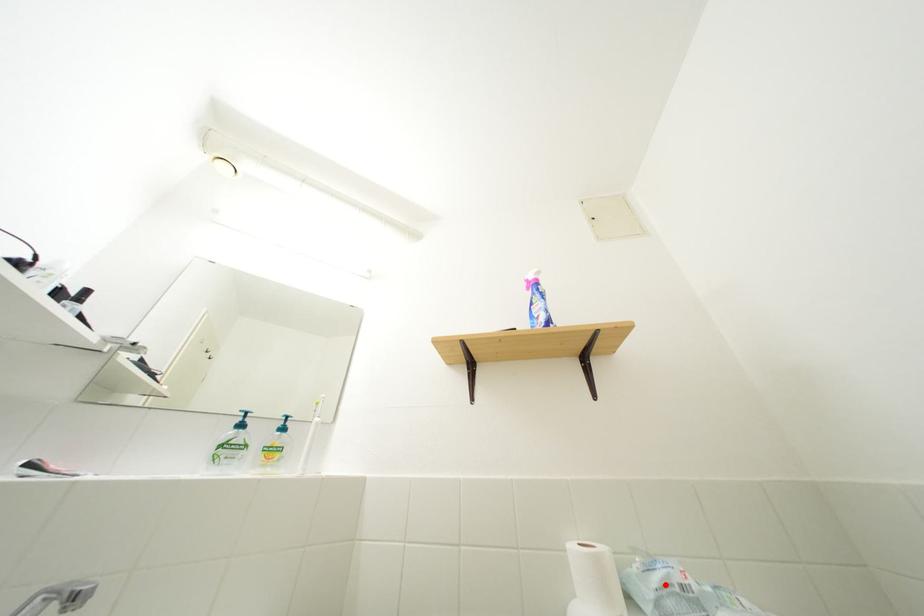
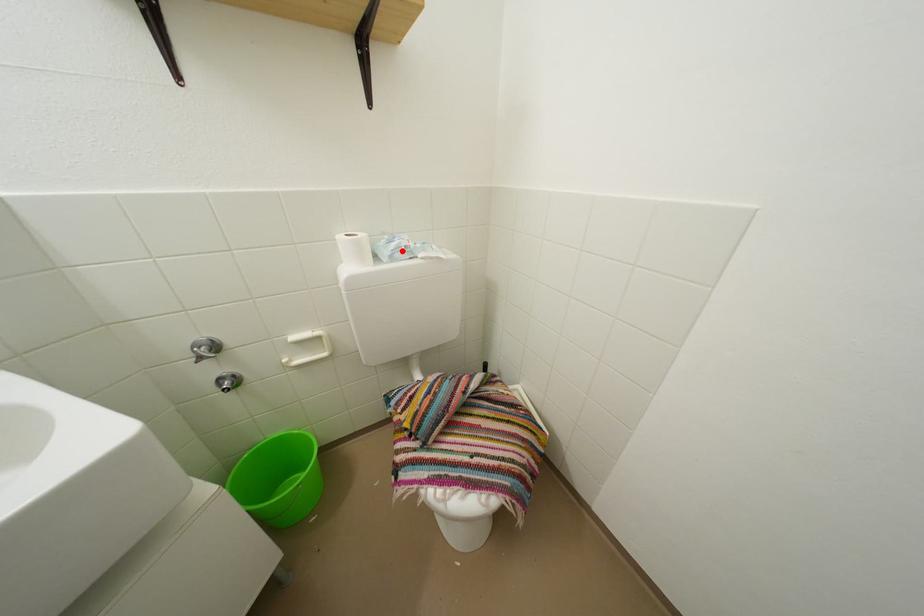
I am providing you with two images of the same scene from different viewpoints. A red point is marked on the first image and another point is marked on the second image. Do the highlighted points in image1 and image2 indicate the same real-world spot?

Yes